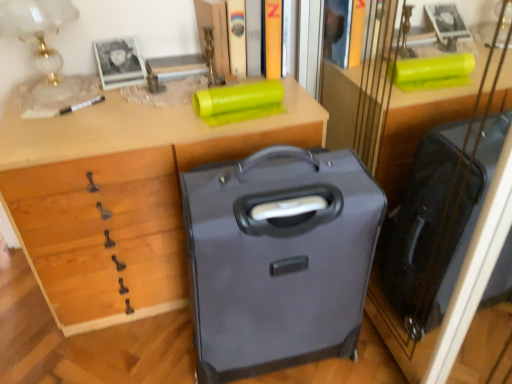
You are a GUI agent. You are given a task and a screenshot of the screen. Output one action in this format:
    pyautogui.click(x=<x>, y=<y>)
    Task: Click on the free space above matte wood desk at center (from a real-world perspective)
    This screenshot has width=512, height=384.
    Given the screenshot: What is the action you would take?
    pyautogui.click(x=138, y=101)